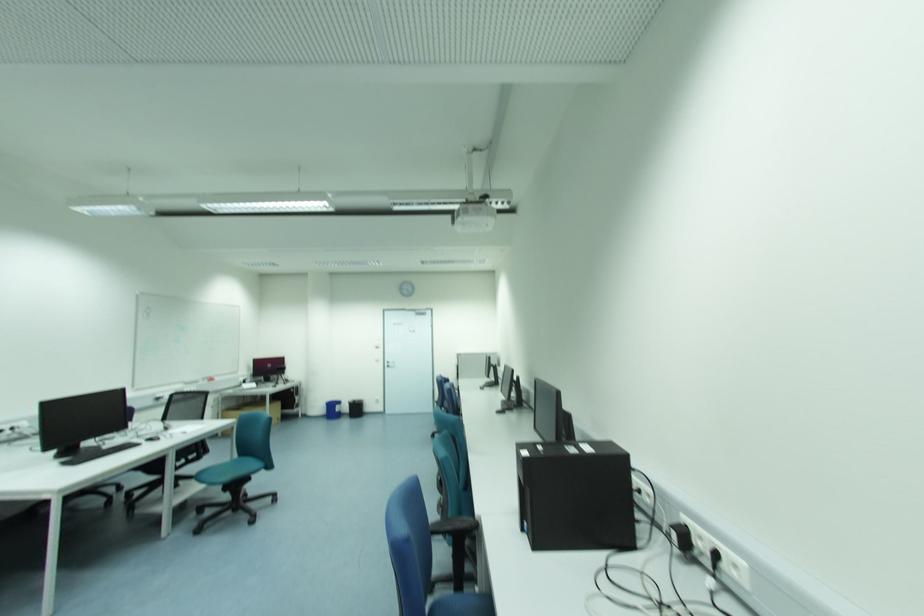
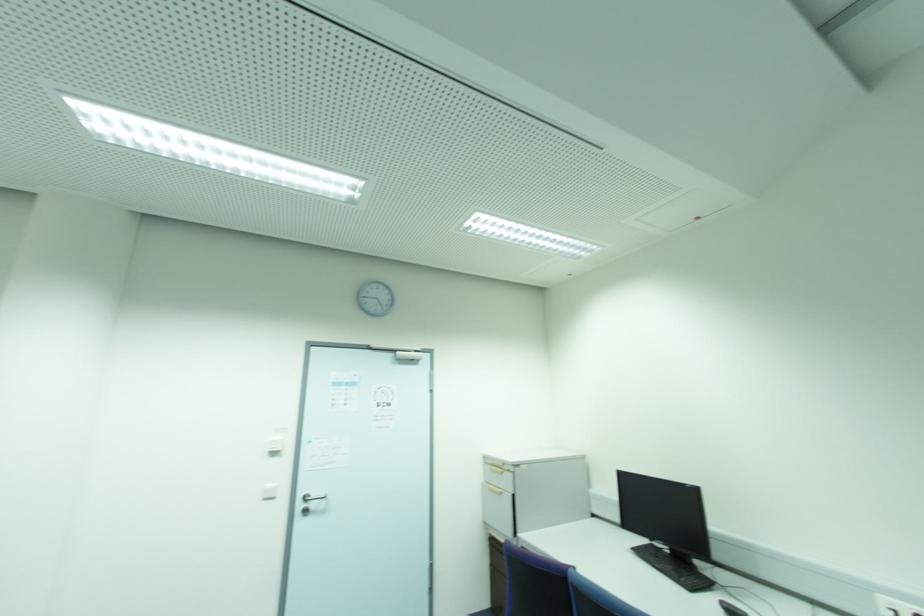
In the second image, find the point that corresponds to point (378, 347) in the first image.

(274, 454)